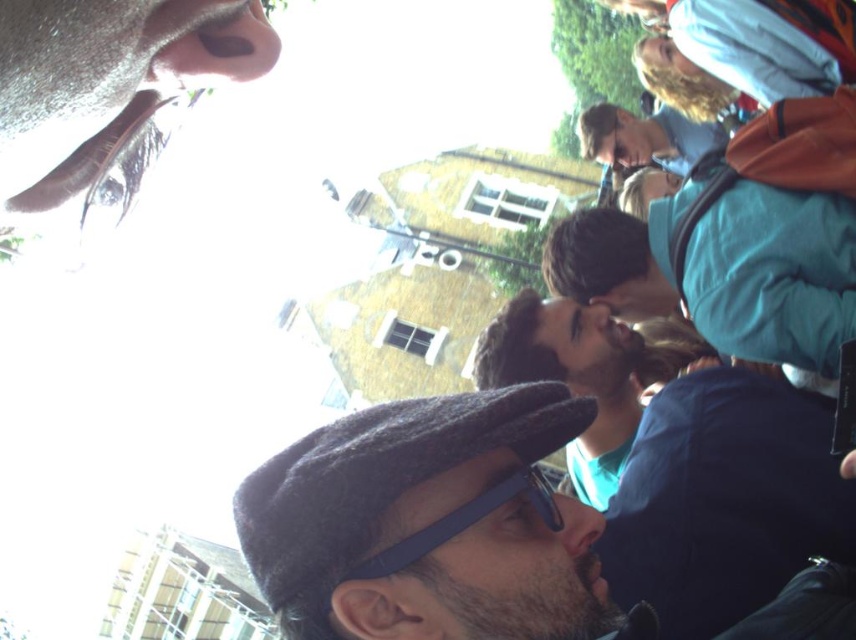
You are a photographer trying to capture a portrait of the person with the matte brown nose at upper left and the person in the matte blue jacket at upper right. Since the nose is thinner than the jacket, which object would require more careful framing to ensure it doesn not get lost in the image?

The matte brown nose at upper left would require more careful framing because it is thinner than the matte blue jacket at upper right and might be less visually prominent.

You are a photographer trying to capture a closeup of the matte brown nose at upper left and the blue rubber goggles at center. Which object should you zoom in on more to ensure both are in focus?

The matte brown nose at upper left is smaller than the blue rubber goggles at center, so you should zoom in more on the matte brown nose at upper left to ensure both are in focus.